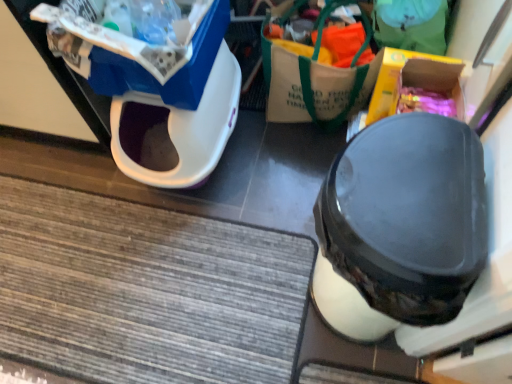
Where is `yellow cardboard box at upper right, which is counted as the 1th storage box, starting from the right`? yellow cardboard box at upper right, which is counted as the 1th storage box, starting from the right is located at coordinates (394, 80).

What do you see at coordinates (137, 49) in the screenshot? This screenshot has width=512, height=384. I see `blue plastic storage box at upper left, the second storage box from the right` at bounding box center [137, 49].

At what (x,y) coordinates should I click in order to perform the action: click on yellow cardboard box at upper right, which is counted as the 1th storage box, starting from the right. Please return your answer as a coordinate pair (x, y). This screenshot has height=384, width=512. Looking at the image, I should click on (394, 80).

Between yellow cardboard box at upper right, the 2th storage box when ordered from left to right, and blue plastic storage box at upper left, the second storage box from the right, which one appears on the right side from the viewer's perspective?

Positioned to the right is yellow cardboard box at upper right, the 2th storage box when ordered from left to right.

In the scene shown: Can we say yellow cardboard box at upper right, which is counted as the 1th storage box, starting from the right, lies outside blue plastic storage box at upper left, the second storage box from the right?

That's correct, yellow cardboard box at upper right, which is counted as the 1th storage box, starting from the right, is outside of blue plastic storage box at upper left, the second storage box from the right.

From a real-world perspective, which object rests below the other?

From a 3D spatial view, yellow cardboard box at upper right, the 2th storage box when ordered from left to right, is below.

Is black matte shoe at center in front of blue plastic storage box at upper left, the second storage box from the right?

Yes, it is.

Considering the sizes of black matte shoe at center and blue plastic storage box at upper left, placed as the 1th storage box when sorted from left to right, in the image, is black matte shoe at center bigger or smaller than blue plastic storage box at upper left, placed as the 1th storage box when sorted from left to right,?

Clearly, black matte shoe at center is larger in size than blue plastic storage box at upper left, placed as the 1th storage box when sorted from left to right.

Can you tell me how much black matte shoe at center and blue plastic storage box at upper left, the second storage box from the right, differ in facing direction?

The facing directions of black matte shoe at center and blue plastic storage box at upper left, the second storage box from the right, are 90 degrees apart.

Can you confirm if black matte shoe at center is positioned to the left of blue plastic storage box at upper left, placed as the 1th storage box when sorted from left to right?

No.

Considering the positions of points (103, 78) and (340, 166), is point (103, 78) farther from camera compared to point (340, 166)?

Yes, it is.

Is blue plastic storage box at upper left, the second storage box from the right, shorter than black matte shoe at center?

Yes.

From the image's perspective, which one is positioned lower, blue plastic storage box at upper left, placed as the 1th storage box when sorted from left to right, or black matte shoe at center?

black matte shoe at center appears lower in the image.

Would you say blue plastic storage box at upper left, placed as the 1th storage box when sorted from left to right, contains black matte shoe at center?

Actually, black matte shoe at center is outside blue plastic storage box at upper left, placed as the 1th storage box when sorted from left to right.

Is yellow cardboard box at upper right, the 2th storage box when ordered from left to right, directly adjacent to white canvas tote bag at upper center?

There is a gap between yellow cardboard box at upper right, the 2th storage box when ordered from left to right, and white canvas tote bag at upper center.

How distant is yellow cardboard box at upper right, the 2th storage box when ordered from left to right, from white canvas tote bag at upper center?

The distance of yellow cardboard box at upper right, the 2th storage box when ordered from left to right, from white canvas tote bag at upper center is 11.14 inches.

Can you confirm if yellow cardboard box at upper right, which is counted as the 1th storage box, starting from the right, is positioned to the left of white canvas tote bag at upper center?

No, yellow cardboard box at upper right, which is counted as the 1th storage box, starting from the right, is not to the left of white canvas tote bag at upper center.

What's the angular difference between yellow cardboard box at upper right, the 2th storage box when ordered from left to right, and white canvas tote bag at upper center's facing directions?

They differ by 98.6 degrees in their facing directions.

From the image's perspective, is yellow cardboard box at upper right, the 2th storage box when ordered from left to right, located beneath white plastic litter bin at upper left?

Actually, yellow cardboard box at upper right, the 2th storage box when ordered from left to right, appears above white plastic litter bin at upper left in the image.

Is yellow cardboard box at upper right, which is counted as the 1th storage box, starting from the right, taller or shorter than white plastic litter bin at upper left?

Considering their sizes, yellow cardboard box at upper right, which is counted as the 1th storage box, starting from the right, has less height than white plastic litter bin at upper left.

Is there a large distance between yellow cardboard box at upper right, which is counted as the 1th storage box, starting from the right, and white plastic litter bin at upper left?

yellow cardboard box at upper right, which is counted as the 1th storage box, starting from the right, is actually quite close to white plastic litter bin at upper left.

Relative to white plastic litter bin at upper left, is yellow cardboard box at upper right, which is counted as the 1th storage box, starting from the right, in front or behind?

Visually, yellow cardboard box at upper right, which is counted as the 1th storage box, starting from the right, is located in front of white plastic litter bin at upper left.

From the picture: Based on their sizes in the image, would you say white plastic litter bin at upper left is bigger or smaller than white canvas tote bag at upper center?

Clearly, white plastic litter bin at upper left is larger in size than white canvas tote bag at upper center.

Consider the image. Is white plastic litter bin at upper left further to the viewer compared to white canvas tote bag at upper center?

No, it is not.

Can you confirm if white plastic litter bin at upper left is shorter than white canvas tote bag at upper center?

No, white plastic litter bin at upper left is not shorter than white canvas tote bag at upper center.

From the picture: From a real-world perspective, who is located lower, white plastic litter bin at upper left or white canvas tote bag at upper center?

white canvas tote bag at upper center, from a real-world perspective.

Is white canvas tote bag at upper center thinner than blue plastic storage box at upper left, placed as the 1th storage box when sorted from left to right?

Yes.

Can you tell me how much white canvas tote bag at upper center and blue plastic storage box at upper left, placed as the 1th storage box when sorted from left to right, differ in facing direction?

6.21 degrees.

Measure the distance from white canvas tote bag at upper center to blue plastic storage box at upper left, the second storage box from the right.

16.06 inches.

Does white canvas tote bag at upper center touch blue plastic storage box at upper left, the second storage box from the right?

No, white canvas tote bag at upper center is not next to blue plastic storage box at upper left, the second storage box from the right.

The height and width of the screenshot is (384, 512). I want to click on storage box that is on the right side of blue plastic storage box at upper left, placed as the 1th storage box when sorted from left to right, so click(x=394, y=80).

This screenshot has width=512, height=384. I want to click on storage box on the left of the black matte shoe at center, so click(137, 49).

When comparing their distances from white plastic litter bin at upper left, does blue plastic storage box at upper left, placed as the 1th storage box when sorted from left to right, or black matte shoe at center seem closer?

Among the two, blue plastic storage box at upper left, placed as the 1th storage box when sorted from left to right, is located nearer to white plastic litter bin at upper left.

Which object lies nearer to the anchor point blue plastic storage box at upper left, the second storage box from the right, black matte shoe at center or white canvas tote bag at upper center?

white canvas tote bag at upper center is closer to blue plastic storage box at upper left, the second storage box from the right.

From the image, which object appears to be farther from white canvas tote bag at upper center, blue plastic storage box at upper left, placed as the 1th storage box when sorted from left to right, or yellow cardboard box at upper right, which is counted as the 1th storage box, starting from the right?

blue plastic storage box at upper left, placed as the 1th storage box when sorted from left to right, is positioned further to the anchor white canvas tote bag at upper center.

Based on their spatial positions, is white canvas tote bag at upper center or blue plastic storage box at upper left, placed as the 1th storage box when sorted from left to right, further from yellow cardboard box at upper right, the 2th storage box when ordered from left to right?

blue plastic storage box at upper left, placed as the 1th storage box when sorted from left to right, lies further to yellow cardboard box at upper right, the 2th storage box when ordered from left to right, than the other object.

Which object lies further to the anchor point white canvas tote bag at upper center, white plastic litter bin at upper left or black matte shoe at center?

black matte shoe at center is positioned further to the anchor white canvas tote bag at upper center.

Which object lies further to the anchor point yellow cardboard box at upper right, the 2th storage box when ordered from left to right, white plastic litter bin at upper left or white canvas tote bag at upper center?

white plastic litter bin at upper left is positioned further to the anchor yellow cardboard box at upper right, the 2th storage box when ordered from left to right.

Estimate the real-world distances between objects in this image. Which object is closer to blue plastic storage box at upper left, the second storage box from the right, white plastic litter bin at upper left or yellow cardboard box at upper right, the 2th storage box when ordered from left to right?

The object closer to blue plastic storage box at upper left, the second storage box from the right, is white plastic litter bin at upper left.

From the picture: Based on their spatial positions, is yellow cardboard box at upper right, which is counted as the 1th storage box, starting from the right, or white plastic litter bin at upper left further from blue plastic storage box at upper left, placed as the 1th storage box when sorted from left to right?

yellow cardboard box at upper right, which is counted as the 1th storage box, starting from the right, is further to blue plastic storage box at upper left, placed as the 1th storage box when sorted from left to right.

Locate an element on the screen. This screenshot has width=512, height=384. garbage located between white plastic litter bin at upper left and yellow cardboard box at upper right, the 2th storage box when ordered from left to right, in the left-right direction is located at coordinates (315, 82).

The height and width of the screenshot is (384, 512). Find the location of `wide between blue plastic storage box at upper left, placed as the 1th storage box when sorted from left to right, and black matte shoe at center, in the horizontal direction`. wide between blue plastic storage box at upper left, placed as the 1th storage box when sorted from left to right, and black matte shoe at center, in the horizontal direction is located at coordinates (179, 128).

Locate an element on the screen. Image resolution: width=512 pixels, height=384 pixels. footwear situated between white plastic litter bin at upper left and yellow cardboard box at upper right, which is counted as the 1th storage box, starting from the right, from left to right is located at coordinates (401, 226).

I want to click on wide between black matte shoe at center and white canvas tote bag at upper center along the z-axis, so click(x=179, y=128).